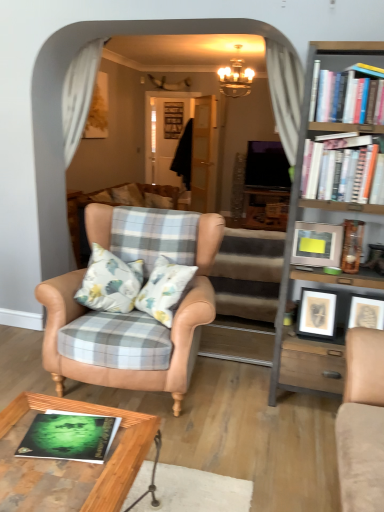
You are a GUI agent. You are given a task and a screenshot of the screen. Output one action in this format:
    pyautogui.click(x=<x>, y=<y>)
    Task: Click on the blank space situated above green matte book at lower left, the first book positioned from the front (from a real-world perspective)
    The image size is (384, 512).
    Given the screenshot: What is the action you would take?
    pyautogui.click(x=81, y=430)